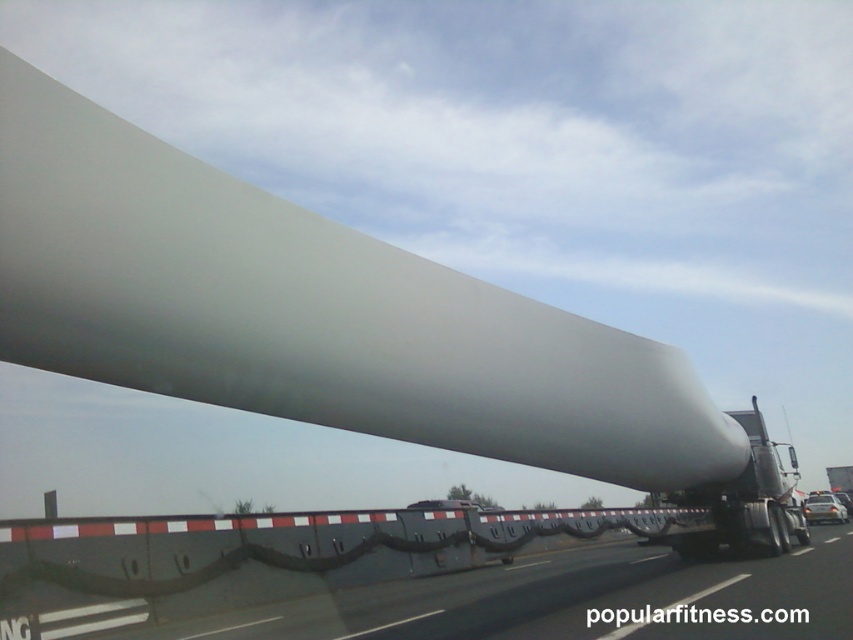
Between black rubber barrier at center and white matte wind turbine blade at right, which one appears on the right side from the viewer's perspective?

Positioned to the right is white matte wind turbine blade at right.

Is black rubber barrier at center wider than white matte wind turbine blade at right?

In fact, black rubber barrier at center might be narrower than white matte wind turbine blade at right.

Does point (200, 548) lie behind point (784, 524)?

No, it is in front of (784, 524).

Identify the location of black rubber barrier at center. The image size is (853, 640). (257, 560).